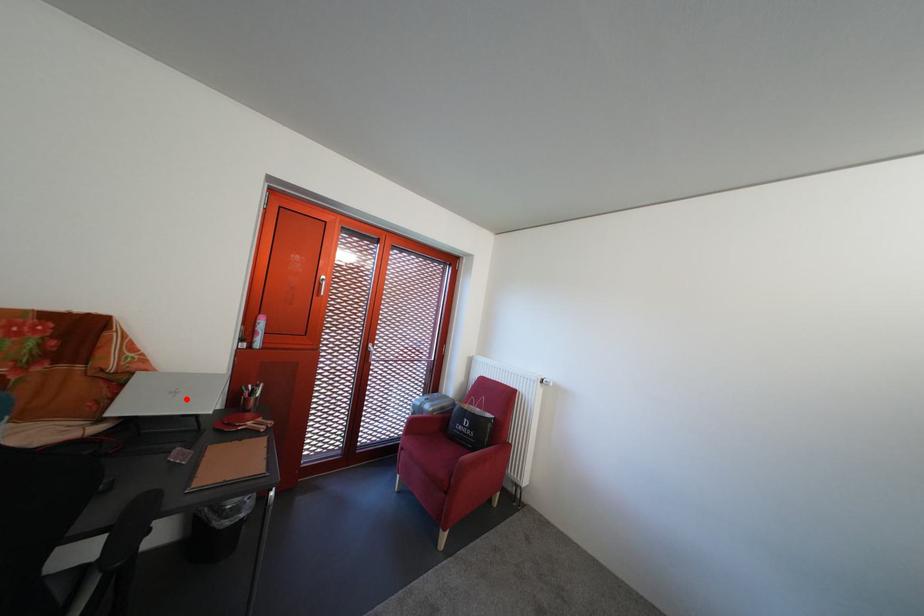
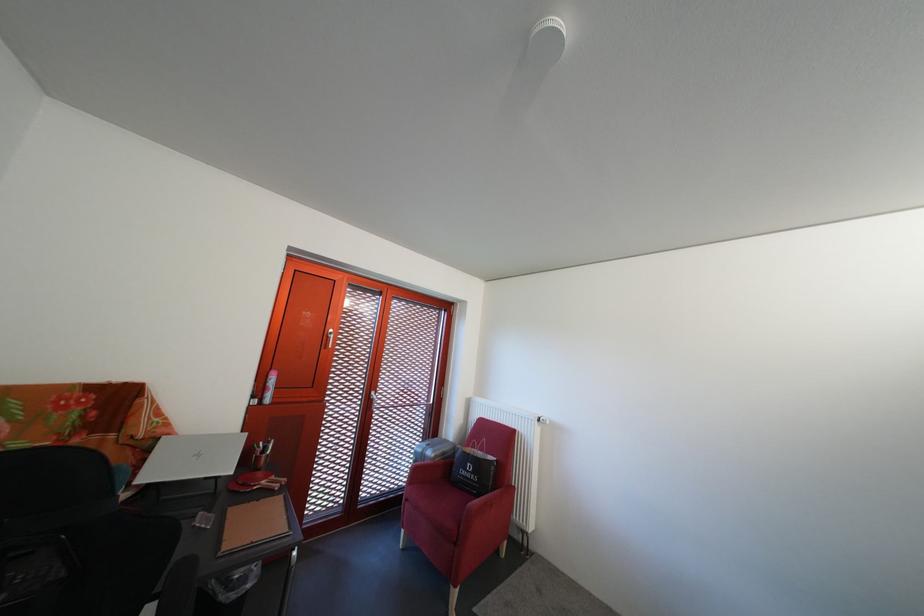
In the second image, find the point that corresponds to the highlighted location in the first image.

(210, 462)